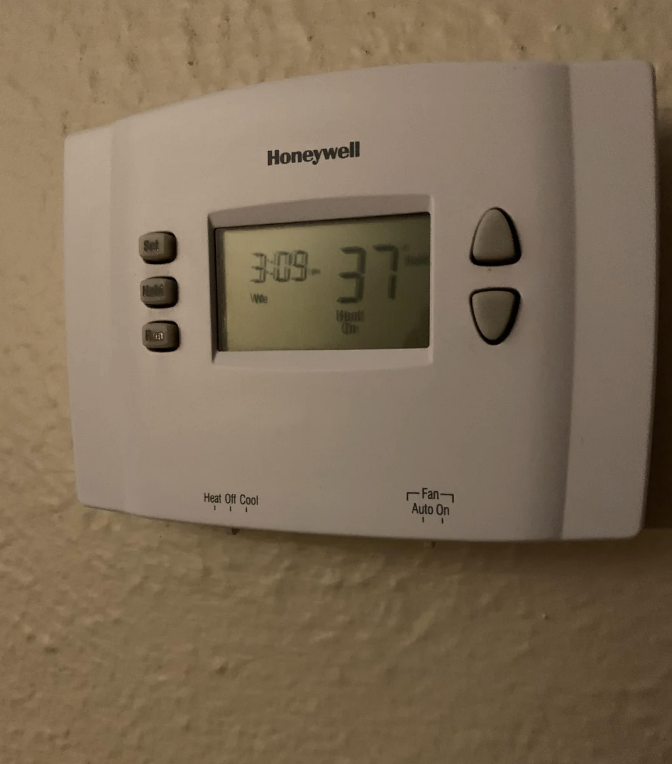
Locate an element on the screen. The image size is (672, 764). honeywell thermostat is located at coordinates (291, 125).